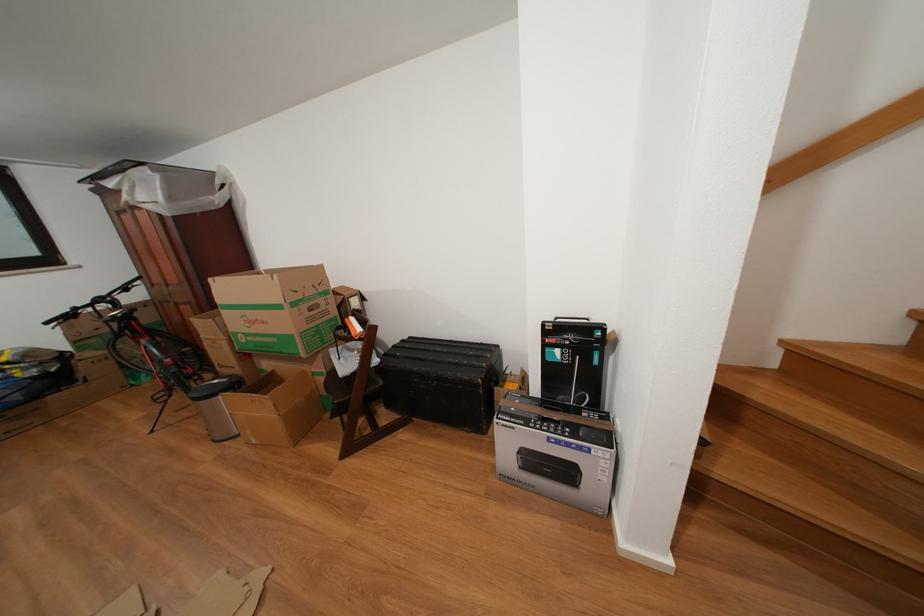
The image size is (924, 616). Find the location of `orange tape dispenser`. orange tape dispenser is located at coordinates (574, 361).